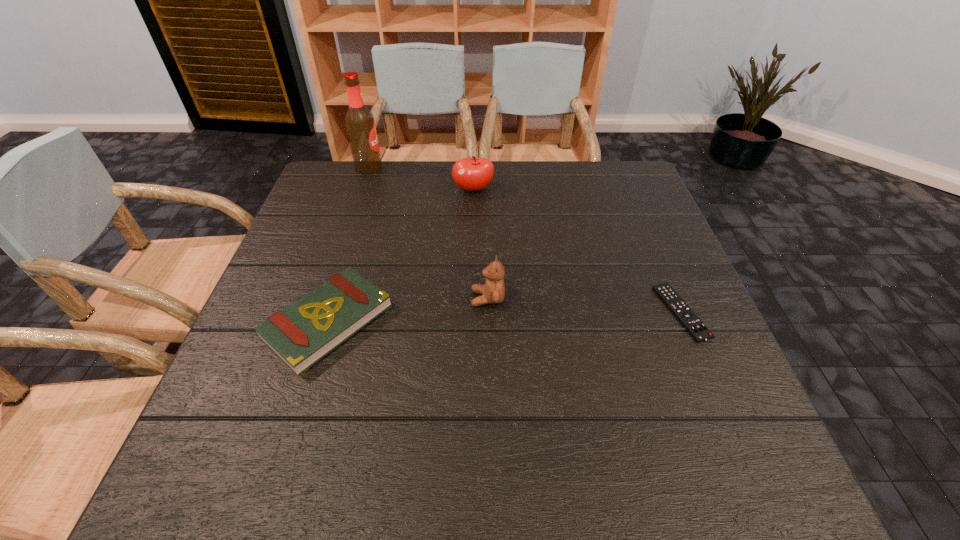
Locate an element on the screen. free space at the far edge of the desktop is located at coordinates (502, 168).

Find the location of `free space at the near edge of the desktop`. free space at the near edge of the desktop is located at coordinates [x=486, y=440].

Locate an element on the screen. This screenshot has height=540, width=960. vacant area at the left edge of the desktop is located at coordinates (328, 213).

The height and width of the screenshot is (540, 960). Find the location of `vacant point at the right edge`. vacant point at the right edge is located at coordinates (598, 211).

Locate an element on the screen. vacant region at the far left corner of the desktop is located at coordinates (336, 183).

The width and height of the screenshot is (960, 540). I want to click on vacant space at the far right corner of the desktop, so click(619, 161).

Find the location of a particular element. The height and width of the screenshot is (540, 960). free point between the farthest object and the second farthest object is located at coordinates (421, 179).

Where is `free space that is in between the fourth tallest object and the beer bottle`? free space that is in between the fourth tallest object and the beer bottle is located at coordinates (348, 245).

This screenshot has height=540, width=960. Find the location of `empty space between the teddy bear and the rightmost object`. empty space between the teddy bear and the rightmost object is located at coordinates (585, 305).

This screenshot has width=960, height=540. Identify the location of free space between the second shortest object and the tallest object. (348, 245).